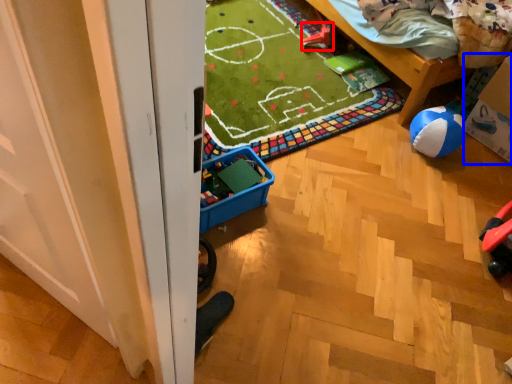
Question: Which object is closer to the camera taking this photo, toy (highlighted by a red box) or cardboard box (highlighted by a blue box)?

Choices:
 (A) toy
 (B) cardboard box

Answer: (B)